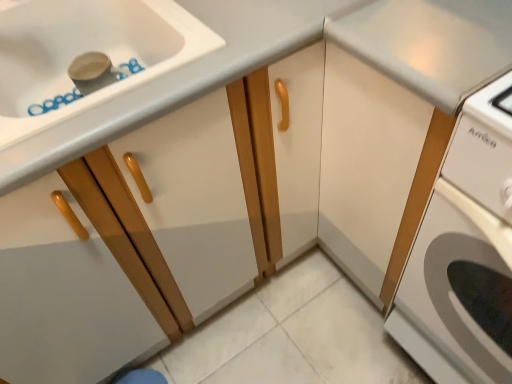
Question: Are matte wood cabinet at left, the 1th cabinetry from the left, and white matte cabinet at center, placed as the 1th cabinetry when sorted from right to left, making contact?

Choices:
 (A) no
 (B) yes

Answer: (A)

Question: Is matte wood cabinet at left, which is the 2th cabinetry from right to left, smaller than white matte cabinet at center, placed as the 1th cabinetry when sorted from right to left?

Choices:
 (A) yes
 (B) no

Answer: (A)

Question: Is matte wood cabinet at left, the 1th cabinetry from the left, oriented towards white matte cabinet at center, placed as the 1th cabinetry when sorted from right to left?

Choices:
 (A) no
 (B) yes

Answer: (A)

Question: Is matte wood cabinet at left, which is the 2th cabinetry from right to left, thinner than white matte cabinet at center, placed as the 1th cabinetry when sorted from right to left?

Choices:
 (A) yes
 (B) no

Answer: (A)

Question: Can you confirm if matte wood cabinet at left, which is the 2th cabinetry from right to left, is wider than white matte cabinet at center, the 2th cabinetry positioned from the left?

Choices:
 (A) yes
 (B) no

Answer: (B)

Question: From the image's perspective, is white glossy washing machine at right located above or below matte wood cabinet at left, which is the 2th cabinetry from right to left?

Choices:
 (A) above
 (B) below

Answer: (B)

Question: From their relative heights in the image, would you say white glossy washing machine at right is taller or shorter than matte wood cabinet at left, which is the 2th cabinetry from right to left?

Choices:
 (A) short
 (B) tall

Answer: (B)

Question: From a real-world perspective, is white glossy washing machine at right positioned above or below matte wood cabinet at left, which is the 2th cabinetry from right to left?

Choices:
 (A) above
 (B) below

Answer: (B)

Question: Relative to matte wood cabinet at left, which is the 2th cabinetry from right to left, is white glossy washing machine at right in front or behind?

Choices:
 (A) behind
 (B) front

Answer: (B)

Question: From a real-world perspective, is white matte cabinet at center, the 2th cabinetry positioned from the left, positioned above or below white glossy washing machine at right?

Choices:
 (A) above
 (B) below

Answer: (A)

Question: Based on their positions, is white matte cabinet at center, the 2th cabinetry positioned from the left, located to the left or right of white glossy washing machine at right?

Choices:
 (A) right
 (B) left

Answer: (B)

Question: Looking at their shapes, would you say white matte cabinet at center, placed as the 1th cabinetry when sorted from right to left, is wider or thinner than white glossy washing machine at right?

Choices:
 (A) wide
 (B) thin

Answer: (B)

Question: Is white matte cabinet at center, placed as the 1th cabinetry when sorted from right to left, inside or outside of white glossy washing machine at right?

Choices:
 (A) outside
 (B) inside

Answer: (A)

Question: From the image's perspective, is matte wood cabinet at left, the 1th cabinetry from the left, located above or below white glossy washing machine at right?

Choices:
 (A) above
 (B) below

Answer: (A)

Question: In the image, is matte wood cabinet at left, the 1th cabinetry from the left, positioned in front of or behind white glossy washing machine at right?

Choices:
 (A) front
 (B) behind

Answer: (B)